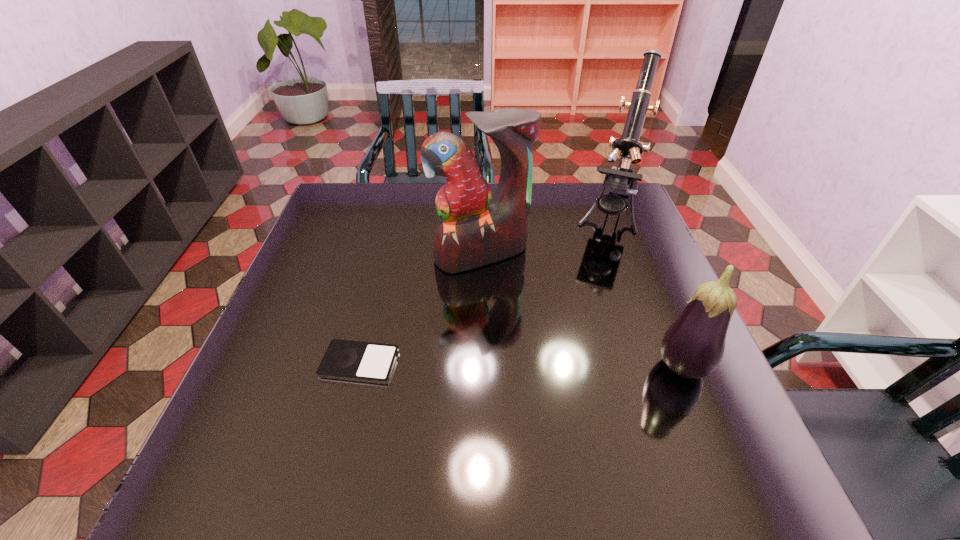
Identify the location of the shortest object. This screenshot has height=540, width=960. (350, 360).

The image size is (960, 540). What are the coordinates of `iPod` in the screenshot? It's located at (350, 360).

Where is `eggplant`? eggplant is located at coordinates (693, 346).

In order to click on parrot in this screenshot , I will do `click(476, 229)`.

This screenshot has height=540, width=960. Identify the location of the second object from left to right. (476, 229).

At what (x,y) coordinates should I click in order to perform the action: click on microscope. Please return your answer as a coordinate pair (x, y). The width and height of the screenshot is (960, 540). Looking at the image, I should click on (621, 177).

I want to click on vacant region located 0.090m on the right of the shortest object, so click(440, 363).

At what (x,y) coordinates should I click in order to perform the action: click on vacant space located 0.170m on the left of the eggplant. Please return your answer as a coordinate pair (x, y). The image size is (960, 540). Looking at the image, I should click on pos(574,369).

This screenshot has height=540, width=960. What are the coordinates of `free space located 0.240m at the face of the third shortest object` in the screenshot? It's located at 544,340.

Find the location of `free space located at the face of the third shortest object`. free space located at the face of the third shortest object is located at coordinates (532, 321).